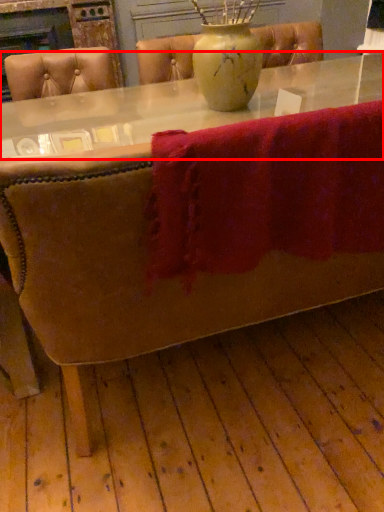
Question: From the image's perspective, what is the correct spatial relationship of round table (annotated by the red box) in relation to bath towel?

Choices:
 (A) above
 (B) below

Answer: (A)